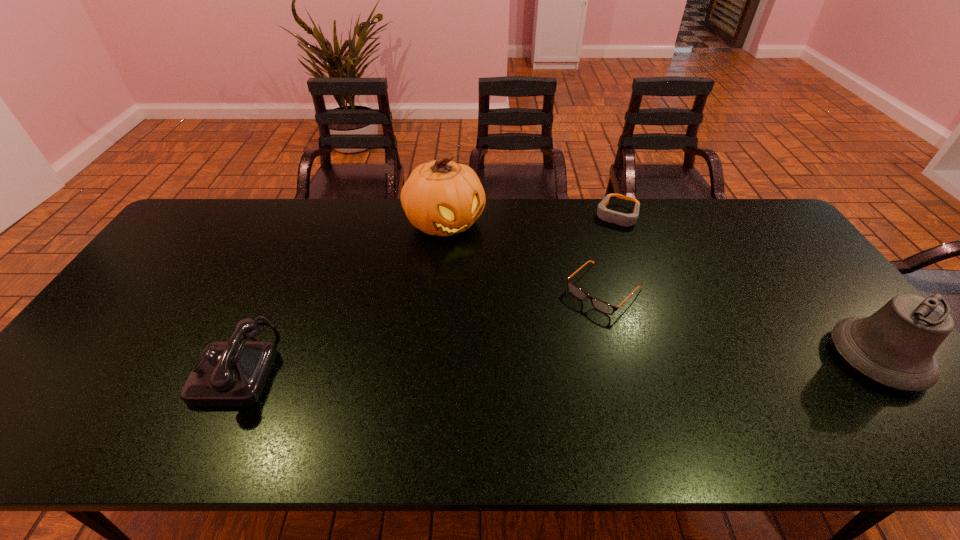
The width and height of the screenshot is (960, 540). Identify the location of the third tallest object. (227, 373).

This screenshot has height=540, width=960. I want to click on the leftmost object, so click(x=227, y=373).

Where is `the fourth shortest object`? the fourth shortest object is located at coordinates (895, 346).

Find the location of a particular element. The image size is (960, 540). the rightmost object is located at coordinates (895, 346).

The width and height of the screenshot is (960, 540). In order to click on the third nearest object in this screenshot , I will do `click(598, 304)`.

Where is `the second object from left to right`? The height and width of the screenshot is (540, 960). the second object from left to right is located at coordinates (443, 198).

Image resolution: width=960 pixels, height=540 pixels. In order to click on pumpkin in this screenshot , I will do `click(443, 198)`.

Locate an element on the screen. Image resolution: width=960 pixels, height=540 pixels. goggles is located at coordinates (622, 219).

What are the coordinates of `free space located on the dial of the third shortest object` in the screenshot? It's located at (133, 363).

The height and width of the screenshot is (540, 960). I want to click on blank area located on the dial of the third shortest object, so [73, 363].